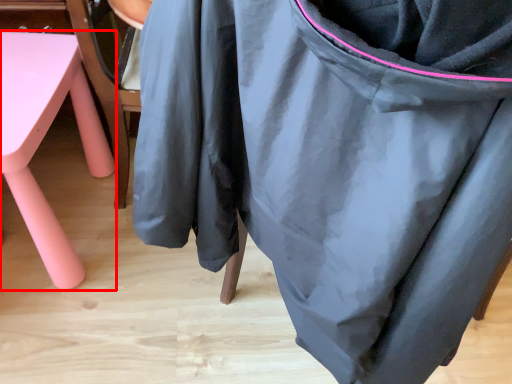
Question: Where is furniture (annotated by the red box) located in relation to bean bag chair in the image?

Choices:
 (A) left
 (B) right

Answer: (A)